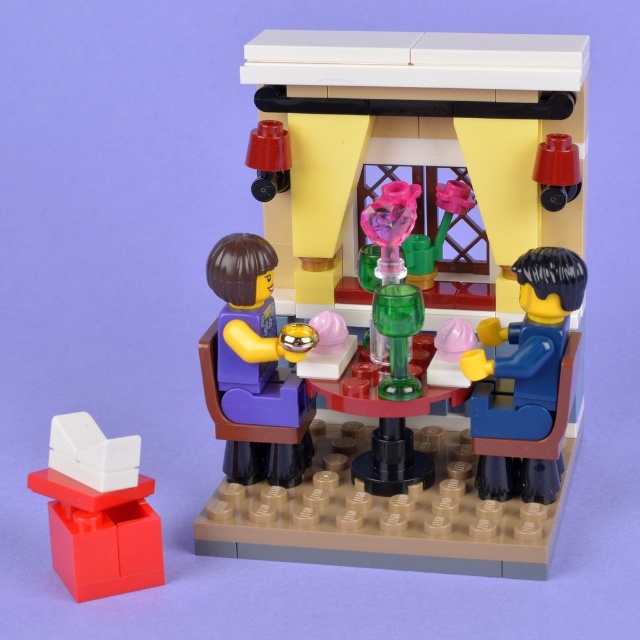
You are a LEGO character standing at the entrance of the room. You want to place a new LEGO accessory on the table. Where should you place it to ensure it doesn not block the view of the matte green vase at center from the entrance?

The matte green vase at center is located at point (416, 150). To avoid blocking its view from the entrance, place the new accessory away from this coordinate on the table.

You are a LEGO character trying to place a small LEGO apple on the table between the matte green vase at center and the blue matte figure at right. Which object should you place the apple closer to if you want it to be closer to the taller object?

The matte green vase at center is taller than the blue matte figure at right. Therefore, to place the apple closer to the taller object, you should position it near the matte green vase at center.

You are a LEGO figure standing at the center of the room. You see two points in the scene, point (234, 445) and point (132, 557). Which point is closer to you?

Point (132, 557) is closer to you because it is in front of point (234, 445).